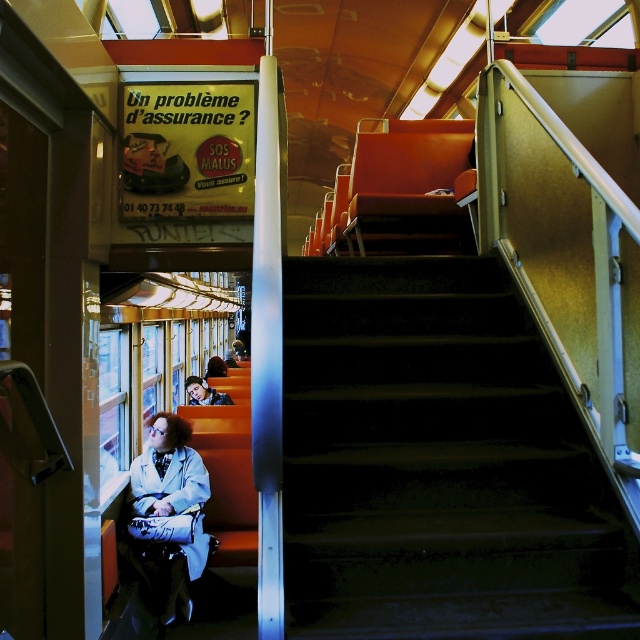
Is dark green carpeted stairs at center wider than white matte coat at lower left?

Correct, the width of dark green carpeted stairs at center exceeds that of white matte coat at lower left.

Can you confirm if dark green carpeted stairs at center is smaller than white matte coat at lower left?

No.

At what (x,y) coordinates should I click in order to perform the action: click on dark green carpeted stairs at center. Please return your answer as a coordinate pair (x, y). The width and height of the screenshot is (640, 640). Looking at the image, I should click on 438,464.